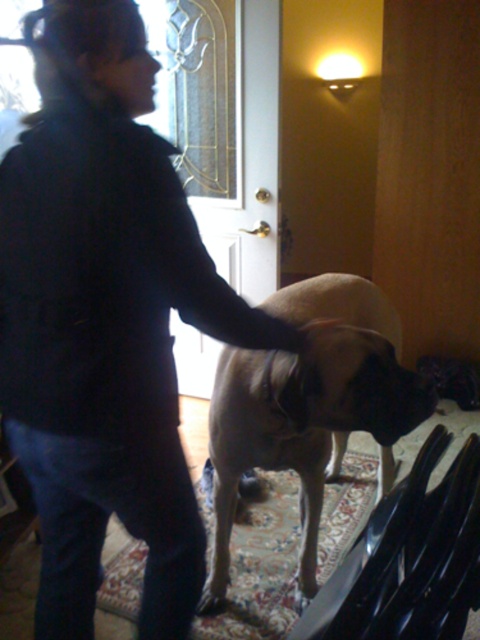
Does matte black dog at center appear under light brown fur at center?

No, matte black dog at center is not below light brown fur at center.

Is matte black dog at center behind light brown fur at center?

That is False.

Is point (59, 269) closer to camera compared to point (238, 483)?

Yes, it is in front of point (238, 483).

You are a GUI agent. You are given a task and a screenshot of the screen. Output one action in this format:
    pyautogui.click(x=<x>, y=<y>)
    Task: Click on the matte black dog at center
    This screenshot has width=480, height=640.
    Given the screenshot: What is the action you would take?
    pyautogui.click(x=105, y=320)